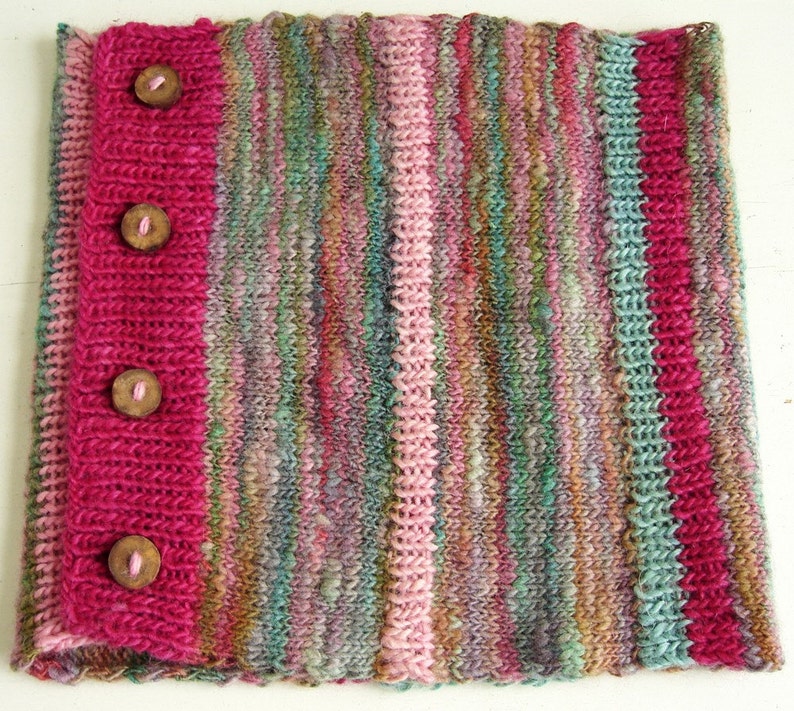
Where is `pink fabric`? Image resolution: width=794 pixels, height=711 pixels. pink fabric is located at coordinates (156, 148), (145, 294), (143, 473), (663, 109), (680, 380), (702, 604).